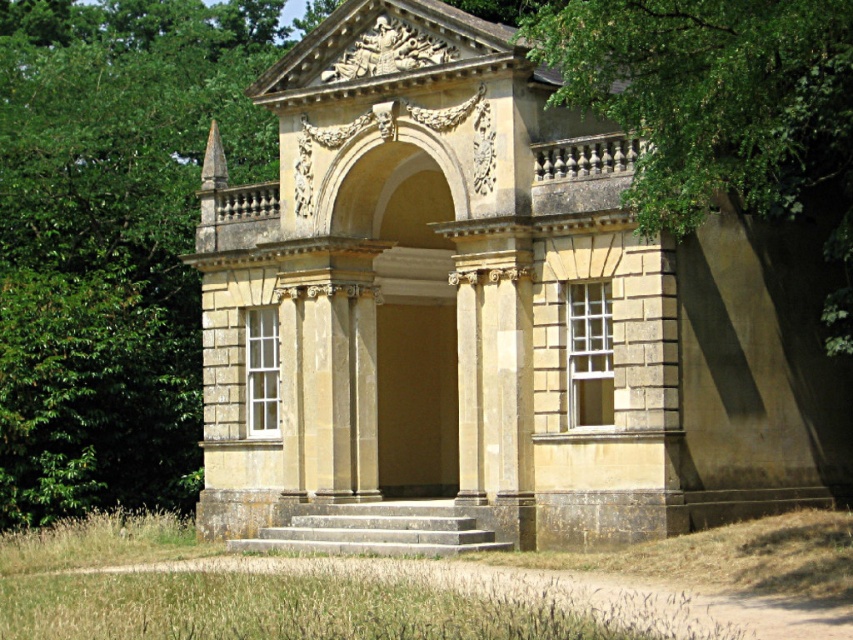
You are standing at the entrance of the classical pavilion and see two points marked in the scene. The first point is at coordinates point (837, 253) and the second is at point (361, 552). Which point is closer to you as you face the entrance?

Point (361, 552) is closer to you because it is in front of point (837, 253), which is behind it.

You are a visitor standing at the entrance of the classical building. You notice a green leafy tree at upper right and smooth stone stairs at center. Which object is positioned higher in the image?

The green leafy tree at upper right is located above the smooth stone stairs at center, so it is positioned higher in the image.